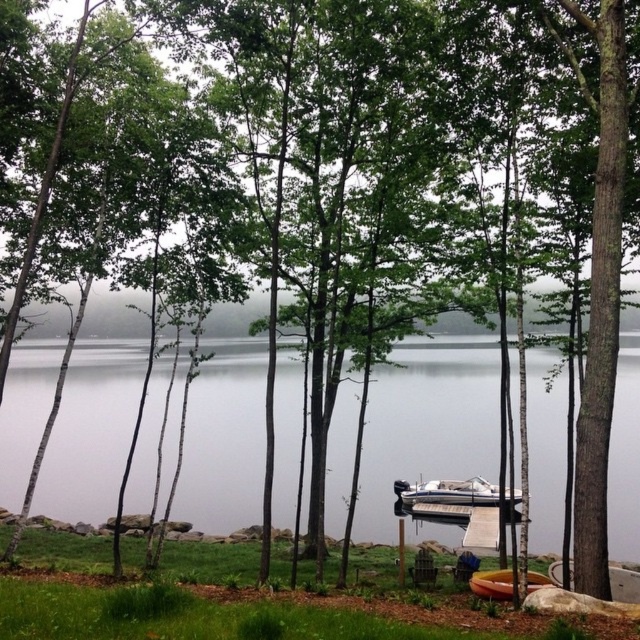
You are standing on the dock and see the white glossy boat at center and the yellow plastic canoe at lower center. Which one is positioned to the right side from your perspective?

The white glossy boat at center is positioned to the right of the yellow plastic canoe at lower center, so from your perspective on the dock, the white glossy boat at center is on the right side.